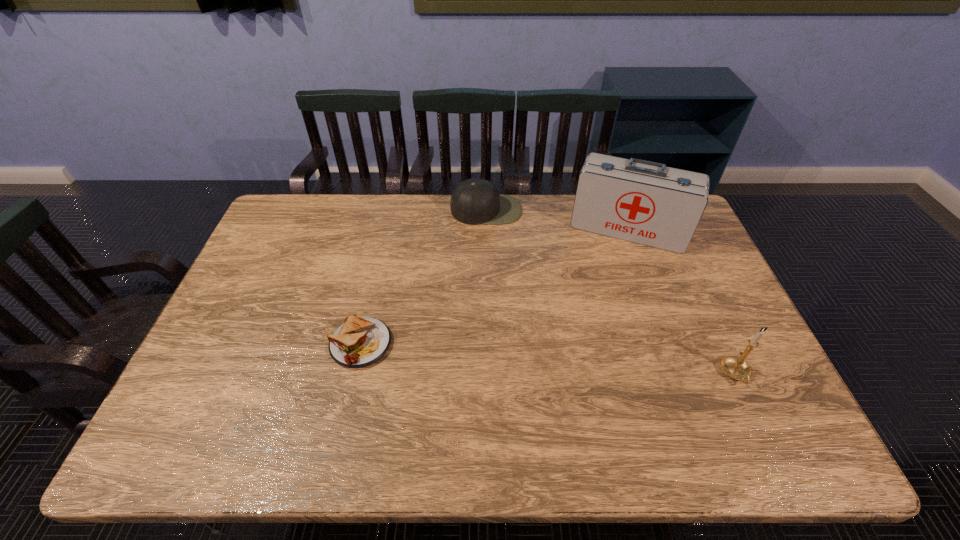
The image size is (960, 540). I want to click on vacant space on the desktop that is between the sandwich and the third shortest object and is positioned on the front-facing side of the tallest object, so click(x=594, y=362).

Locate an element on the screen. vacant spot on the desktop that is between the sandwich and the second tallest object and is positioned on the brim of the cap is located at coordinates (500, 355).